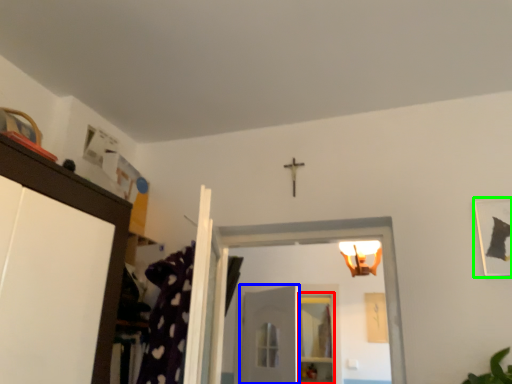
Question: Based on their relative distances, which object is farther from shelf (highlighted by a red box)? Choose from door (highlighted by a blue box) and picture frame (highlighted by a green box).

Choices:
 (A) door
 (B) picture frame

Answer: (B)